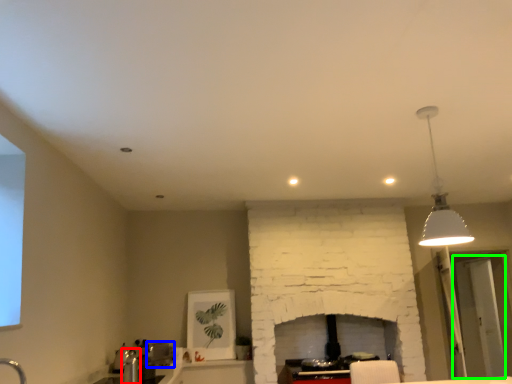
Question: Which object is positioned farthest from faucet (highlighted by a red box)? Select from appliance (highlighted by a blue box) and glass door (highlighted by a green box).

Choices:
 (A) appliance
 (B) glass door

Answer: (B)